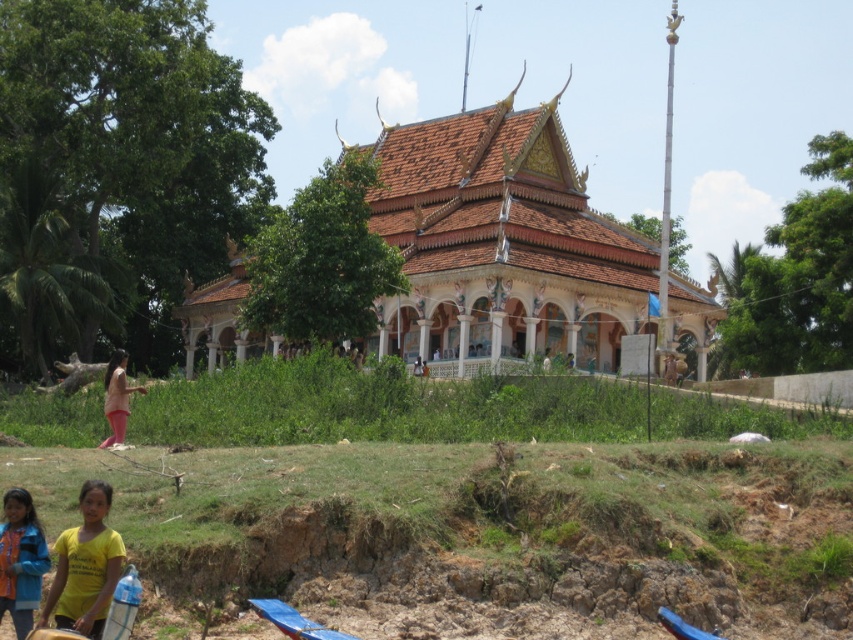
You are standing in front of the traditional Southeast Asian building and notice a specific point marked at coordinates point (515, 250). Based on the scene description, where exactly is this point located?

The point (515, 250) is located on the brown tiled roof at center.

You are standing in front of the traditional Southeast Asian building and see a point marked at coordinates (670, 369). According to the scene description, where exactly is this point located?

The point is located on the brown fabric person at center.

You are standing at the temple entrance and want to take a photo of both the point at coordinate (393, 196) and the point at coordinate (96, 483). Which point should you focus on first to ensure both are in the frame?

You should focus on point (96, 483) first because it is closer to you than point (393, 196), which is behind it. By centering your camera on the closer point, you can adjust the zoom to include both points within the frame.